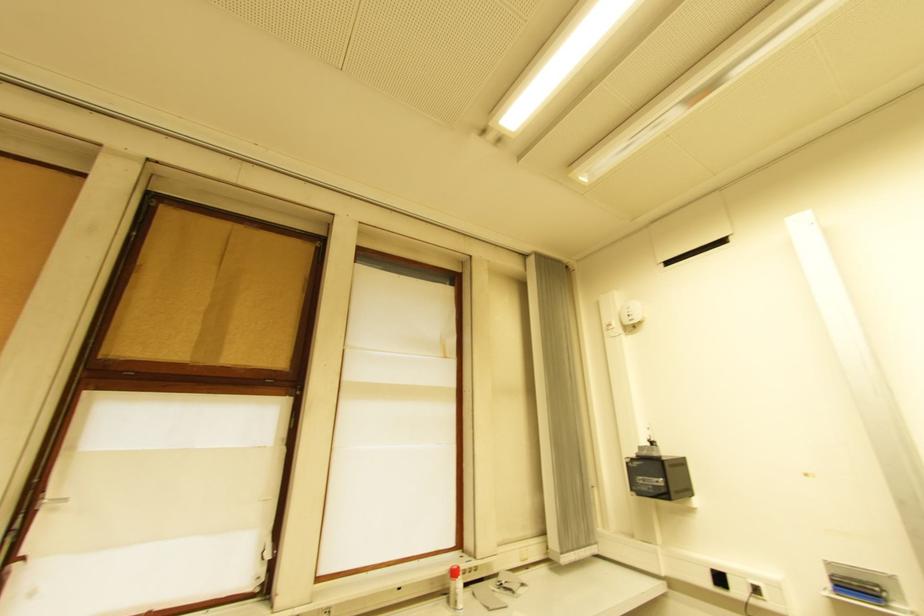
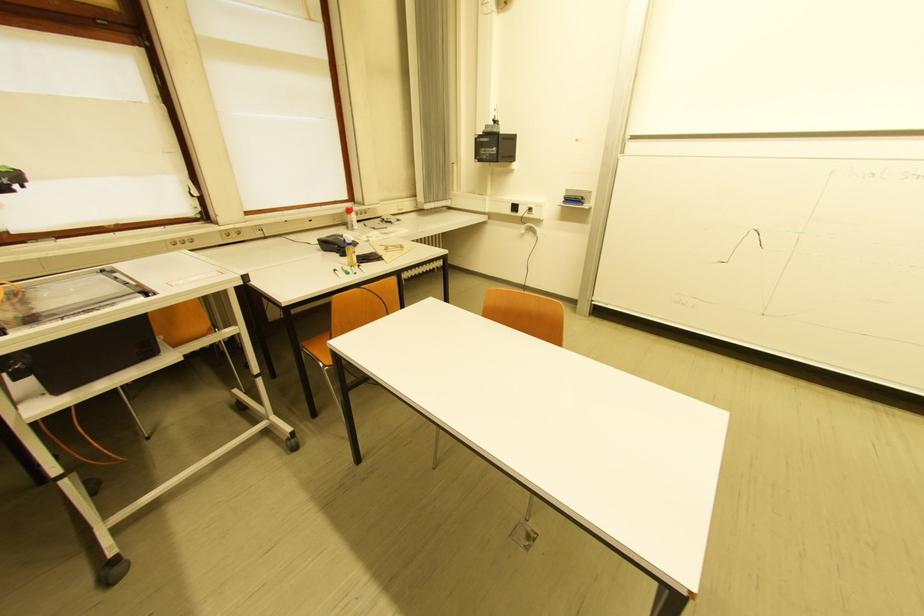
Where in the second image is the point corresponding to point 849,588 from the first image?

(575, 201)